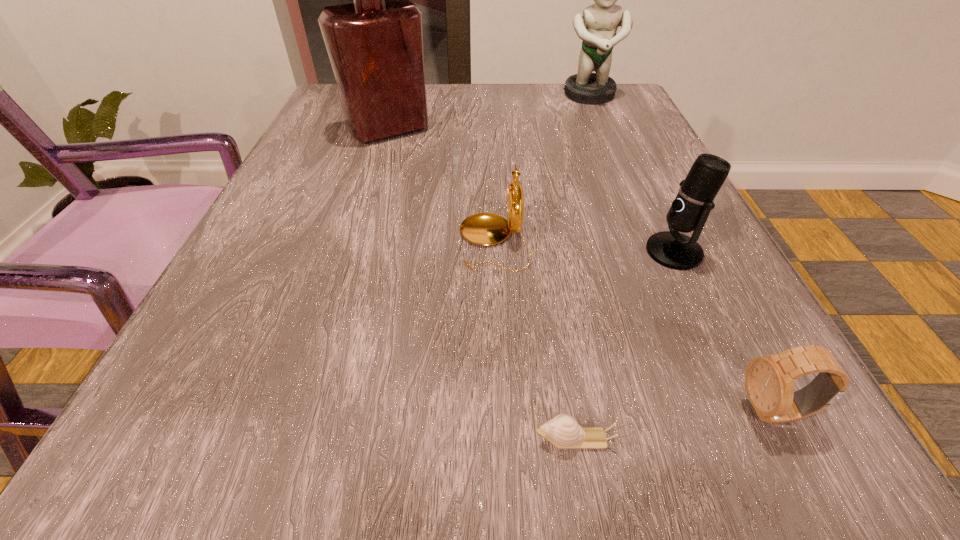
I want to click on object present at the near right corner, so click(769, 381).

In the image, there is a desktop. Where is `blank space at the far edge`? This screenshot has width=960, height=540. blank space at the far edge is located at coordinates (541, 104).

Locate an element on the screen. This screenshot has width=960, height=540. vacant region at the near edge of the desktop is located at coordinates (437, 446).

Where is `free space at the left edge`? This screenshot has width=960, height=540. free space at the left edge is located at coordinates (348, 144).

Where is `free space at the right edge`? The height and width of the screenshot is (540, 960). free space at the right edge is located at coordinates (x=674, y=358).

Find the location of a particular element. The image size is (960, 540). free region at the near left corner is located at coordinates (205, 432).

The image size is (960, 540). In the image, there is a desktop. Find the location of `vacant space at the far right corner`. vacant space at the far right corner is located at coordinates (580, 122).

Identify the location of free spot between the tallest object and the pocket watch. The width and height of the screenshot is (960, 540). (441, 186).

Find the location of a particular element. blank region between the farthest object and the shortest object is located at coordinates 583,267.

Identify the location of vacant area that lies between the fourth shortest object and the liquor. (531, 191).